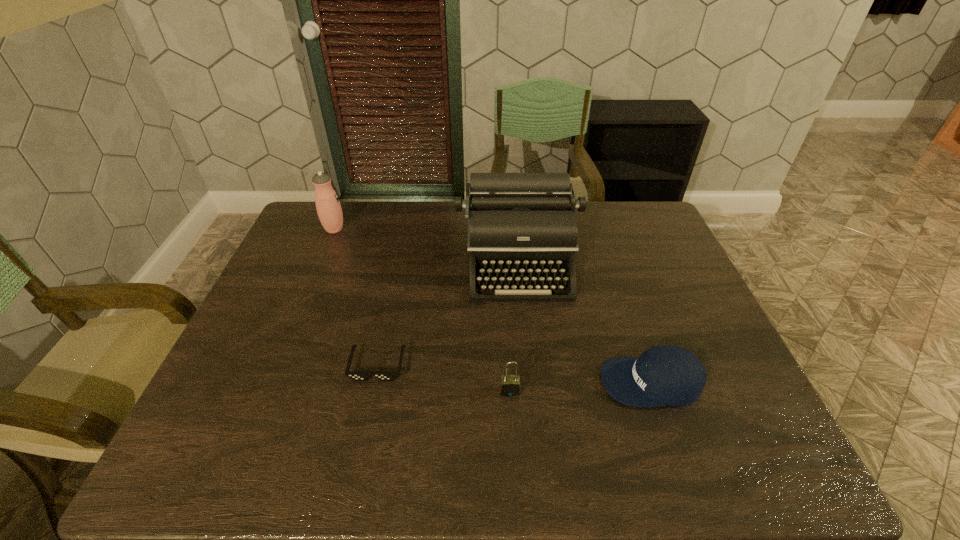
Identify the location of free space between the leftmost object and the shortest object. This screenshot has height=540, width=960. (356, 297).

I want to click on vacant space that is in between the sunglasses and the third shortest object, so click(444, 378).

The height and width of the screenshot is (540, 960). Find the location of `empty space that is in between the second shortest object and the padlock`. empty space that is in between the second shortest object and the padlock is located at coordinates (581, 386).

Locate an element on the screen. vacant area between the leftmost object and the baseball cap is located at coordinates (492, 306).

Point out which object is positioned as the third nearest to the typewriter. Please provide its 2D coordinates. Your answer should be formatted as a tuple, i.e. [(x, y)], where the tuple contains the x and y coordinates of a point satisfying the conditions above.

[(509, 385)]

This screenshot has width=960, height=540. Find the location of `object that is the closest to the leftmost object`. object that is the closest to the leftmost object is located at coordinates (521, 227).

You are a GUI agent. You are given a task and a screenshot of the screen. Output one action in this format:
    pyautogui.click(x=<x>, y=<y>)
    Task: Click on the vacant area in the image that satisfies the following two spatial constraints: 1. on the front-facing side of the baseball cap; 2. on the shackle of the third tallest object
    
    Given the screenshot: What is the action you would take?
    pyautogui.click(x=654, y=391)